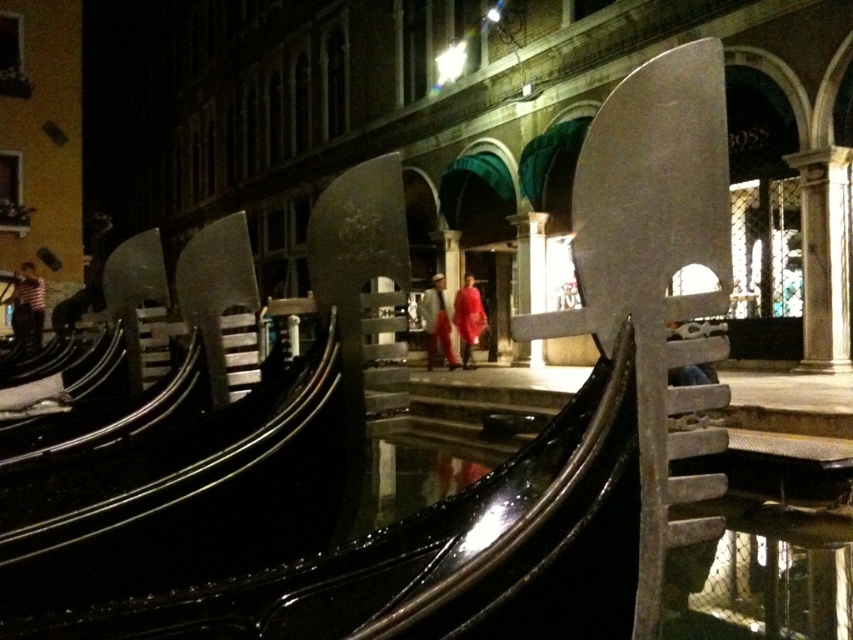
Between point (38, 339) and point (444, 340), which one is positioned behind?

Positioned behind is point (444, 340).

This screenshot has width=853, height=640. Describe the element at coordinates (27, 307) in the screenshot. I see `striped cotton shirt at left` at that location.

Locate an element on the screen. The height and width of the screenshot is (640, 853). striped cotton shirt at left is located at coordinates (27, 307).

Does striped cotton shirt at left appear on the right side of matte red cape at center?

Incorrect, striped cotton shirt at left is not on the right side of matte red cape at center.

Is point (33, 266) behind point (468, 291)?

Yes, point (33, 266) is farther from viewer.

Find the location of a particular element. The height and width of the screenshot is (640, 853). striped cotton shirt at left is located at coordinates (27, 307).

The height and width of the screenshot is (640, 853). What are the coordinates of `striped cotton shirt at left` in the screenshot? It's located at (27, 307).

What do you see at coordinates (437, 323) in the screenshot? I see `red fabric coat at center` at bounding box center [437, 323].

The height and width of the screenshot is (640, 853). Find the location of `red fabric coat at center`. red fabric coat at center is located at coordinates (437, 323).